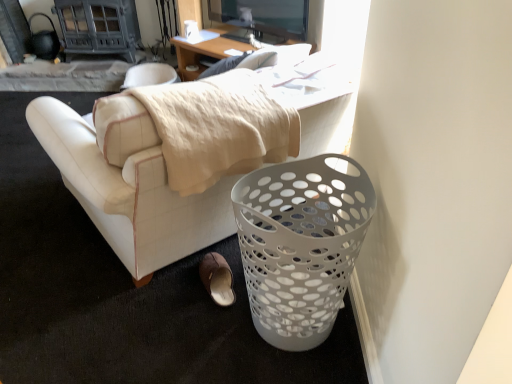
Question: Should I look upward or downward to see brown suede slipper at lower center?

Choices:
 (A) up
 (B) down

Answer: (B)

Question: Is brown suede slipper at lower center positioned with its back to white perforated trash bin at lower right?

Choices:
 (A) yes
 (B) no

Answer: (A)

Question: Can you confirm if brown suede slipper at lower center is smaller than white perforated trash bin at lower right?

Choices:
 (A) yes
 (B) no

Answer: (A)

Question: Is brown suede slipper at lower center to the right of white perforated trash bin at lower right from the viewer's perspective?

Choices:
 (A) no
 (B) yes

Answer: (A)

Question: Can you confirm if brown suede slipper at lower center is shorter than white perforated trash bin at lower right?

Choices:
 (A) no
 (B) yes

Answer: (B)

Question: Is white perforated trash bin at lower right located within brown suede slipper at lower center?

Choices:
 (A) yes
 (B) no

Answer: (B)

Question: Is brown suede slipper at lower center further to camera compared to white perforated trash bin at lower right?

Choices:
 (A) yes
 (B) no

Answer: (A)

Question: Is white leather couch at center with white perforated trash bin at lower right?

Choices:
 (A) no
 (B) yes

Answer: (A)

Question: Does white leather couch at center have a larger size compared to white perforated trash bin at lower right?

Choices:
 (A) yes
 (B) no

Answer: (A)

Question: From a real-world perspective, does white leather couch at center sit lower than white perforated trash bin at lower right?

Choices:
 (A) no
 (B) yes

Answer: (A)

Question: Considering the relative positions of white leather couch at center and white perforated trash bin at lower right in the image provided, is white leather couch at center to the left of white perforated trash bin at lower right from the viewer's perspective?

Choices:
 (A) no
 (B) yes

Answer: (B)

Question: Is white leather couch at center oriented away from white perforated trash bin at lower right?

Choices:
 (A) yes
 (B) no

Answer: (A)

Question: Does white leather couch at center come behind white perforated trash bin at lower right?

Choices:
 (A) yes
 (B) no

Answer: (B)

Question: From a real-world perspective, is white perforated trash bin at lower right under white leather couch at center?

Choices:
 (A) no
 (B) yes

Answer: (B)